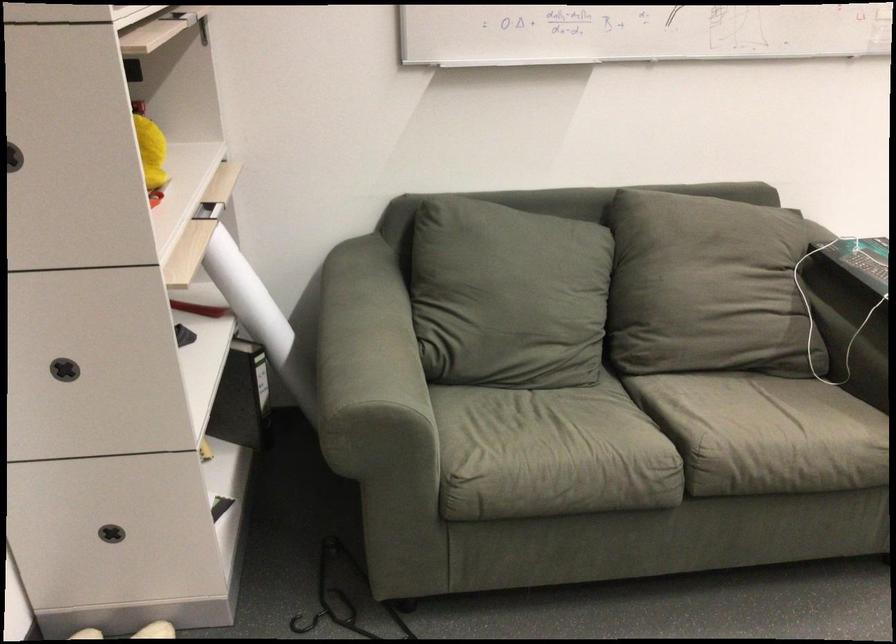
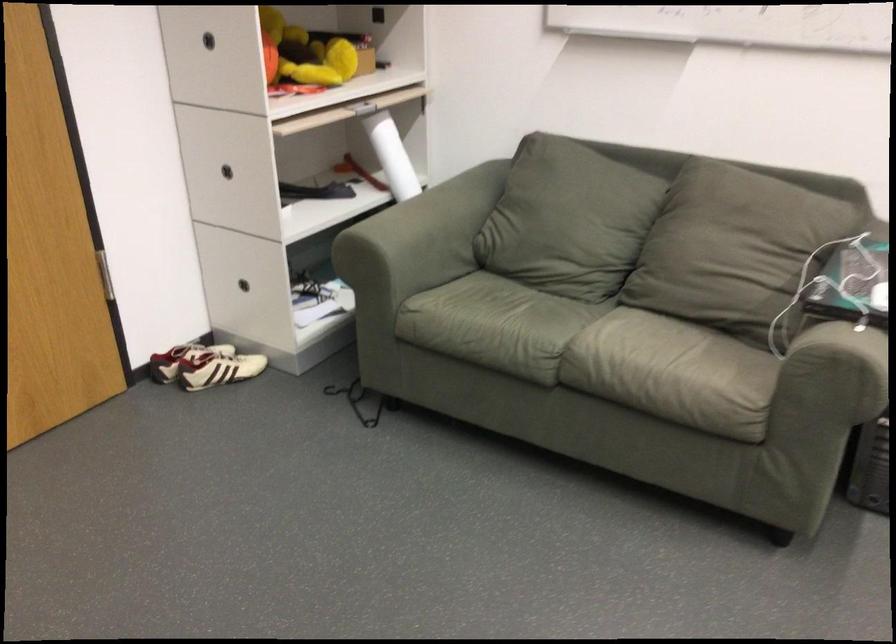
Find the pixel in the second image that matches point 234,268 in the first image.

(392, 156)